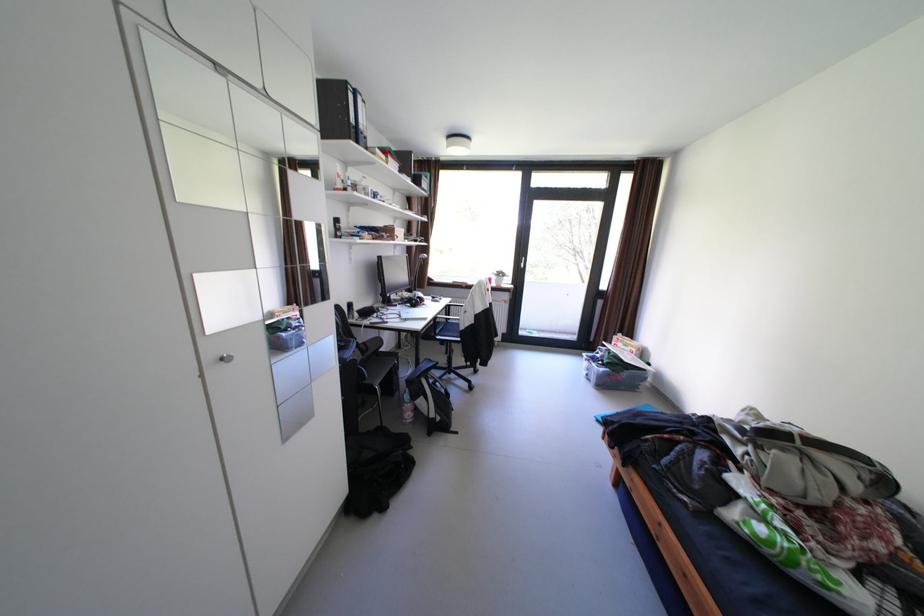
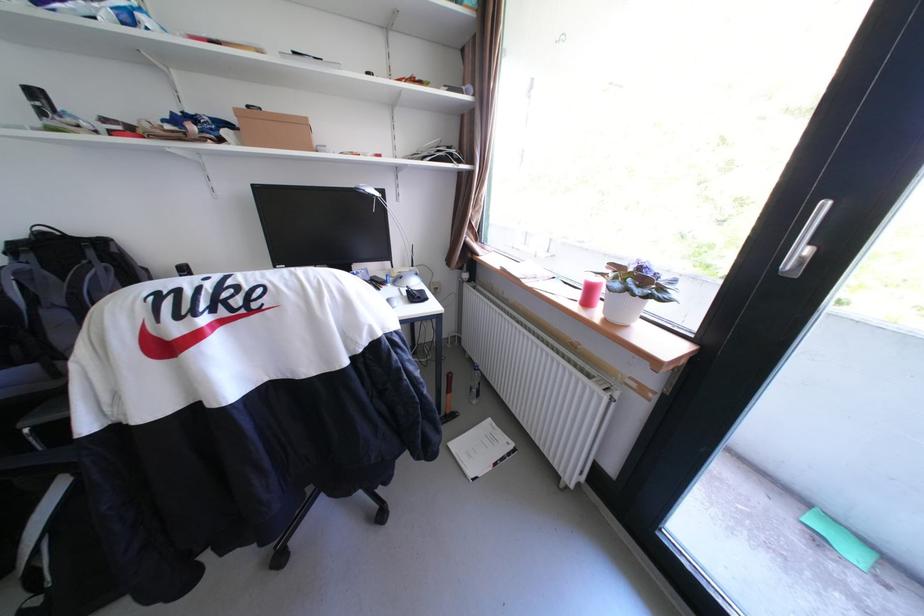
Locate, in the second image, the point that corresponds to pixel 505 285 in the first image.

(608, 313)